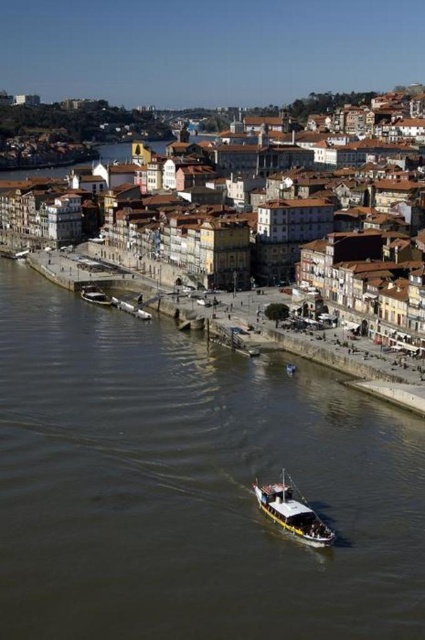
You are a tourist standing at the riverside and want to take a photo of the brown textured buildings at center. Where should you position yourself to capture them in the frame?

To capture the brown textured buildings at center in the frame, position yourself at the riverside facing towards the center of the image, as their 2D location is at point coordinates 0.359 on the x and 0.708 on the y axis.

You are a tourist standing on the riverside and want to take a photo of both the brown textured buildings at center and the metallic silver boat at lower left. Which object should you position closer to the right side of your camera frame?

You should position the brown textured buildings at center closer to the right side of your camera frame since the brown textured buildings at center is to the right of metallic silver boat at lower left.